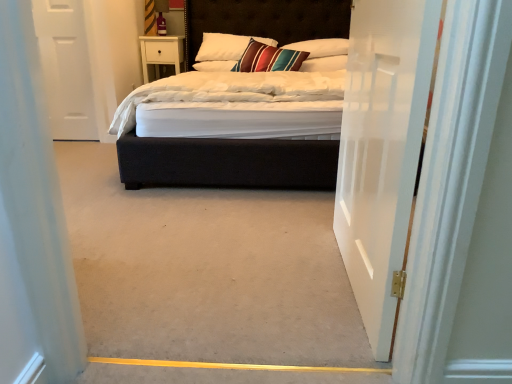
Question: Considering the positions of velvet black bed at center and velvet-like multicolored pillow at center, which is the second pillow from left to right, in the image, is velvet black bed at center bigger or smaller than velvet-like multicolored pillow at center, which is the second pillow from left to right,?

Choices:
 (A) big
 (B) small

Answer: (A)

Question: Is velvet black bed at center inside or outside of velvet-like multicolored pillow at center, which appears as the 3th pillow when viewed from the right?

Choices:
 (A) inside
 (B) outside

Answer: (B)

Question: Which object is positioned farthest from the white glossy door at center, arranged as the 1th door when viewed from the right?

Choices:
 (A) white soft pillow at upper center, which appears as the 3th pillow when viewed from the left
 (B) white soft pillow at upper center, which ranks as the fourth pillow in left-to-right order
 (C) velvet-like multicolored pillow at center, which is the second pillow from left to right
 (D) white soft pillow at center, which is counted as the fourth pillow, starting from the right
 (E) velvet black bed at center

Answer: (E)

Question: Which is nearer to the velvet-like multicolored pillow at center, which appears as the 3th pillow when viewed from the right?

Choices:
 (A) white soft pillow at center, the 1th pillow positioned from the left
 (B) white glossy door at center, arranged as the 1th door when viewed from the right
 (C) white soft pillow at upper center, which appears as the 3th pillow when viewed from the left
 (D) velvet black bed at center
 (E) white matte door at left, placed as the 1th door when sorted from left to right

Answer: (A)